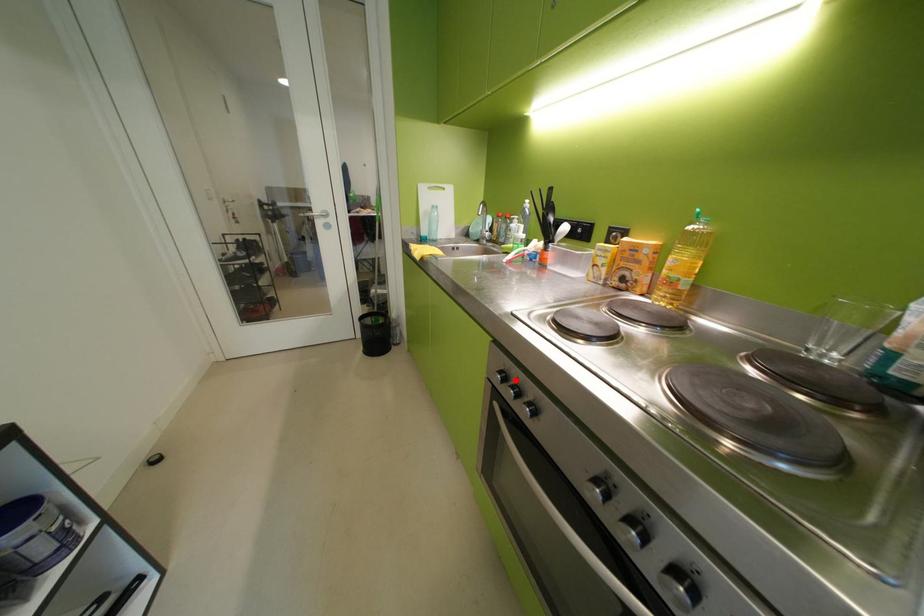
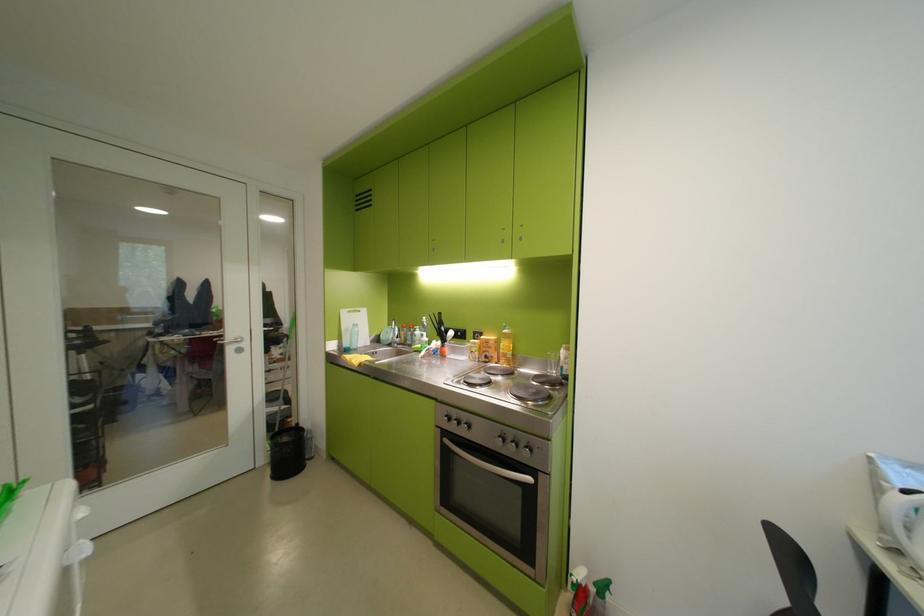
The point at the highlighted location is marked in the first image. Where is the corresponding point in the second image?

(459, 419)